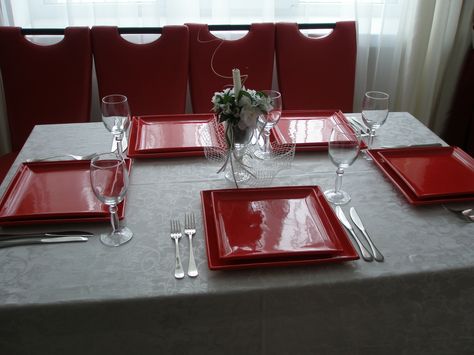
Locate an element on the screen. The image size is (474, 355). silverware is located at coordinates (51, 237), (67, 230), (172, 236), (190, 221), (342, 223), (352, 216), (452, 207), (463, 216), (390, 141), (73, 155).